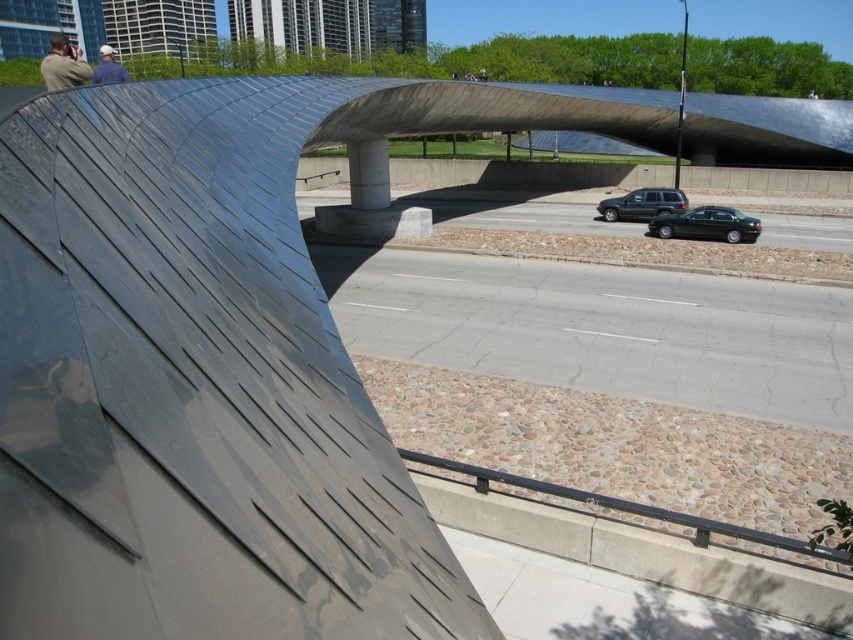
You are standing at the point marked as point (62,42) in the image. If you want to take a photo of the entire metallic wave roof structure without moving your position, will your camera be able to capture the whole structure in one shot? Please consider the distance between you and the camera.

The distance between you and the camera is 10.81 meters. However, the question mentions capturing the entire metallic wave roof structure from your current position. The provided information does not specify the field of view of your camera or the size of the structure. Without knowing these details, it is impossible to determine if the entire structure can be captured in one shot.

You are a pedestrian standing at the grassy area beyond the road. You see the shiny black sedan at center right and the blue denim jacket at upper left. Which object is closer to your current position?

The shiny black sedan at center right is closer to your current position because it is positioned on the right side of the blue denim jacket at upper left, which is further away.